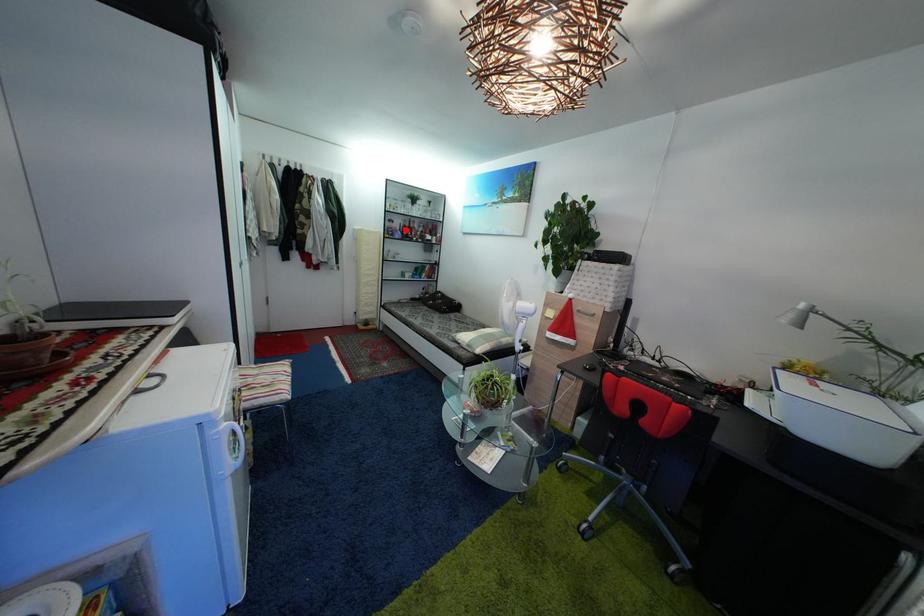
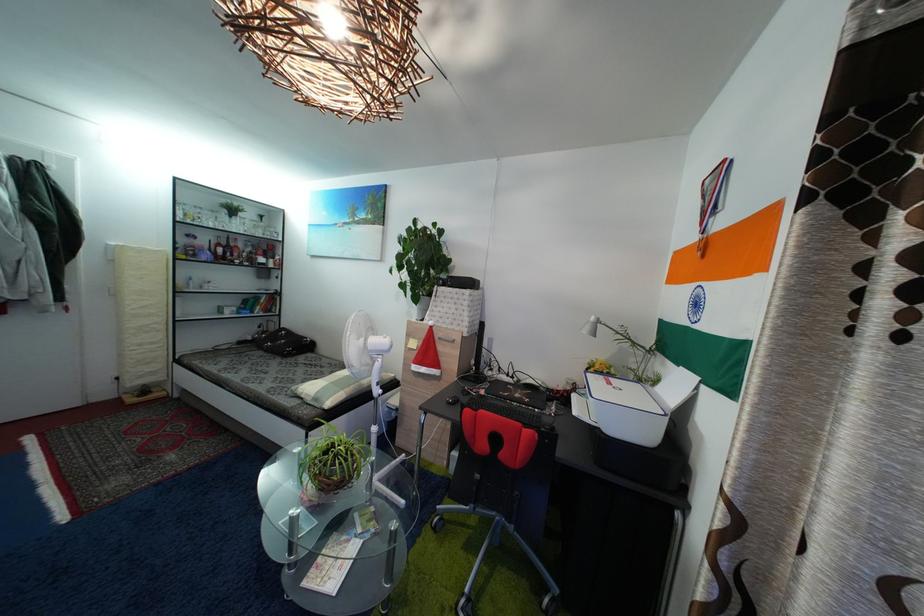
Question: A red point is marked in image1. In image2, is the corresponding 3D point closer to the camera or farther? Reply with the corresponding letter.

Choices:
 (A) The corresponding 3D point is closer.
 (B) The corresponding 3D point is farther.

Answer: (B)